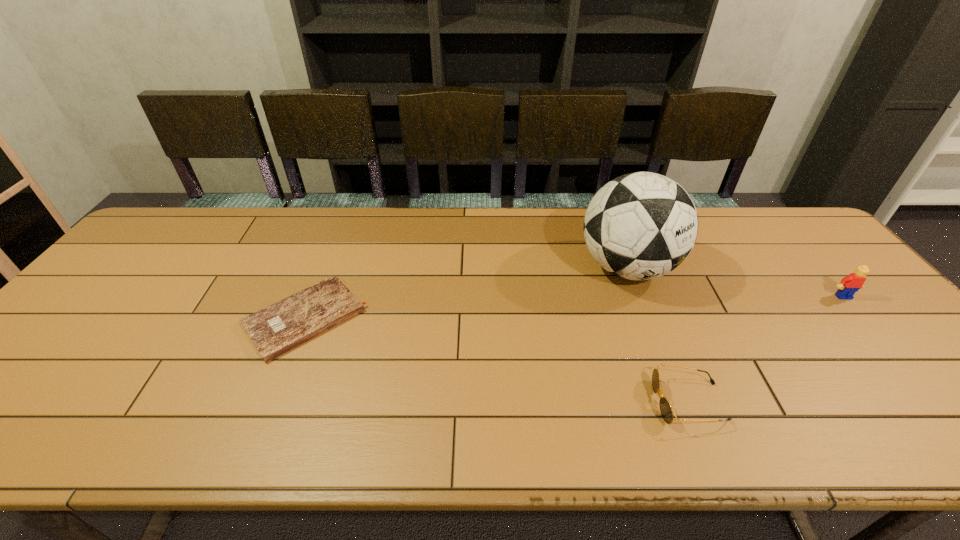
The width and height of the screenshot is (960, 540). Identify the location of free location located on the front-facing side of the sunglasses. (559, 402).

What are the coordinates of `vacant space located on the front-facing side of the sunglasses` in the screenshot? It's located at (536, 402).

Locate an element on the screen. vacant point located on the front of the Bible is located at coordinates (271, 405).

Where is `object located at the far edge`? This screenshot has height=540, width=960. object located at the far edge is located at coordinates (639, 226).

Where is `object situated at the near edge`? This screenshot has height=540, width=960. object situated at the near edge is located at coordinates (666, 411).

Locate an element on the screen. object positioned at the right edge is located at coordinates (850, 284).

Identify the location of vacant space at the far edge. (702, 218).

You are a GUI agent. You are given a task and a screenshot of the screen. Output one action in this format:
    pyautogui.click(x=<x>, y=<y>)
    Task: Click on the vacant space at the near edge of the desktop
    This screenshot has width=960, height=540.
    Given the screenshot: What is the action you would take?
    pyautogui.click(x=756, y=447)

Where is `free spot at the left edge of the desktop`? free spot at the left edge of the desktop is located at coordinates (118, 306).

Image resolution: width=960 pixels, height=540 pixels. In order to click on vacant space at the right edge in this screenshot , I will do `click(823, 273)`.